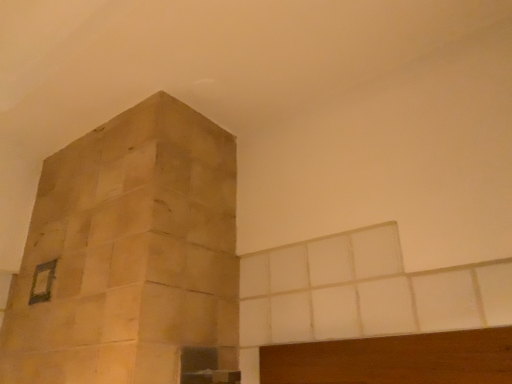
What do you see at coordinates (42, 282) in the screenshot?
I see `green glass window at lower left` at bounding box center [42, 282].

Measure the distance between point (31, 300) and camera.

Point (31, 300) is 3.41 feet from camera.

This screenshot has height=384, width=512. Identify the location of green glass window at lower left. (42, 282).

What is the approximate width of green glass window at lower left?

It is 1.18 inches.

Locate an element on the screen. Image resolution: width=512 pixels, height=384 pixels. green glass window at lower left is located at coordinates (42, 282).